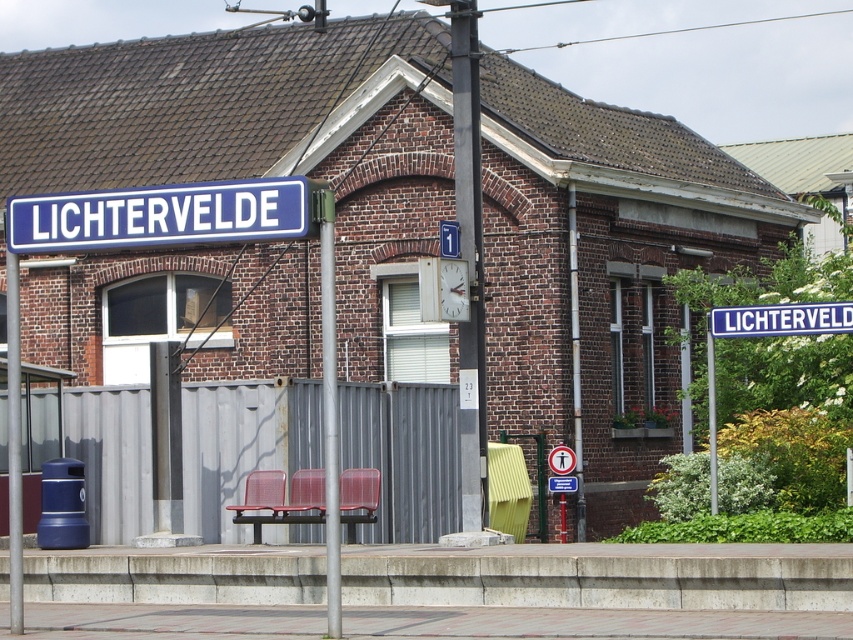
You are standing at the entrance of the LICHTERVELDE station building and want to place a new sign on the platform. The sign must be placed exactly at the coordinates given for the metallic pole at center. Where should you place the new sign relative to the blue trash bin?

The metallic pole at center is located at point (468, 256). Since the blue trash bin is positioned to the left of the platform, the new sign should be placed to the right of the blue trash bin.

You are standing on the platform looking at the station building. There is a blue metallic signboard at upper left and a clock mounted on the wall. Which object is closer to the top of the building?

The blue metallic signboard at upper left is closer to the top of the building because it is located at point (161,216), which is higher up compared to the clock near the center.